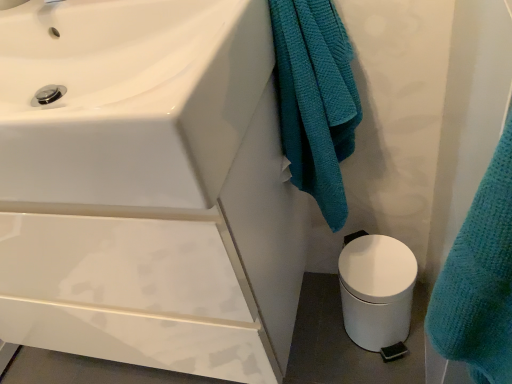
Question: In terms of height, does teal textured towel at center look taller or shorter compared to white glossy sink at upper left?

Choices:
 (A) tall
 (B) short

Answer: (A)

Question: Looking at their shapes, would you say teal textured towel at center is wider or thinner than white glossy sink at upper left?

Choices:
 (A) thin
 (B) wide

Answer: (A)

Question: Which is farther from the white matte trash can at lower right?

Choices:
 (A) teal textured towel at center
 (B) white glossy sink at upper left

Answer: (B)

Question: Which object is positioned closest to the teal textured towel at center?

Choices:
 (A) white matte trash can at lower right
 (B) white glossy sink at upper left

Answer: (B)